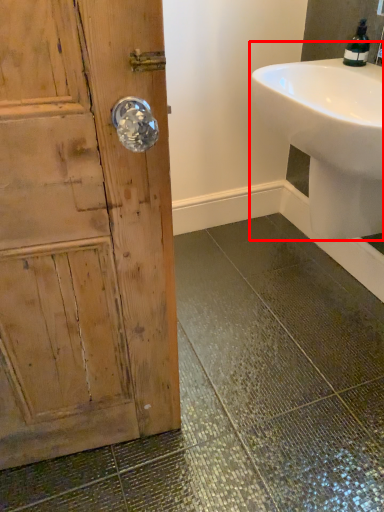
Question: From the image's perspective, what is the correct spatial positioning of sink (annotated by the red box) in reference to soap dispenser?

Choices:
 (A) below
 (B) above

Answer: (A)